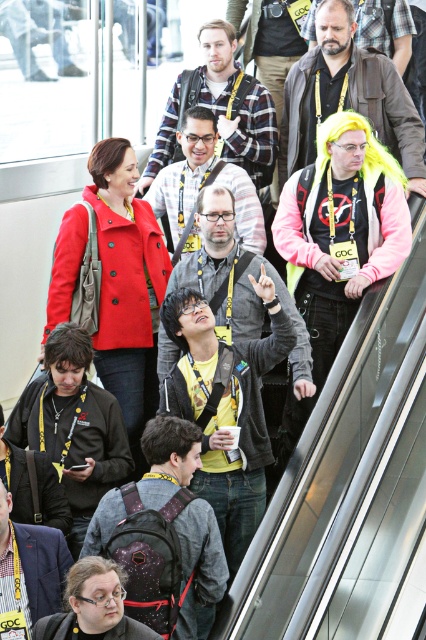
Between shiny yellow wig at upper right and plaid shirt at upper center, which one appears on the right side from the viewer's perspective?

shiny yellow wig at upper right is more to the right.

Is the position of shiny yellow wig at upper right more distant than that of plaid shirt at upper center?

No, shiny yellow wig at upper right is closer to the viewer.

Is point (389, 68) behind point (273, 113)?

No.

Where is `shiny yellow wig at upper right`? The image size is (426, 640). shiny yellow wig at upper right is located at coordinates (347, 97).

Which is more to the left, shiny yellow wig at upper right or matte gray hoodie at center?

matte gray hoodie at center is more to the left.

At what (x,y) coordinates should I click in order to perform the action: click on shiny yellow wig at upper right. Please return your answer as a coordinate pair (x, y). The image size is (426, 640). Looking at the image, I should click on (347, 97).

This screenshot has height=640, width=426. What do you see at coordinates (347, 97) in the screenshot?
I see `shiny yellow wig at upper right` at bounding box center [347, 97].

Locate an element on the screen. The image size is (426, 640). shiny yellow wig at upper right is located at coordinates (347, 97).

Does plaid shirt at upper center have a larger size compared to matte gray hoodie at center?

No, plaid shirt at upper center is not bigger than matte gray hoodie at center.

This screenshot has height=640, width=426. What do you see at coordinates (221, 109) in the screenshot?
I see `plaid shirt at upper center` at bounding box center [221, 109].

The image size is (426, 640). Describe the element at coordinates (221, 109) in the screenshot. I see `plaid shirt at upper center` at that location.

The width and height of the screenshot is (426, 640). Identify the location of plaid shirt at upper center. coord(221,109).